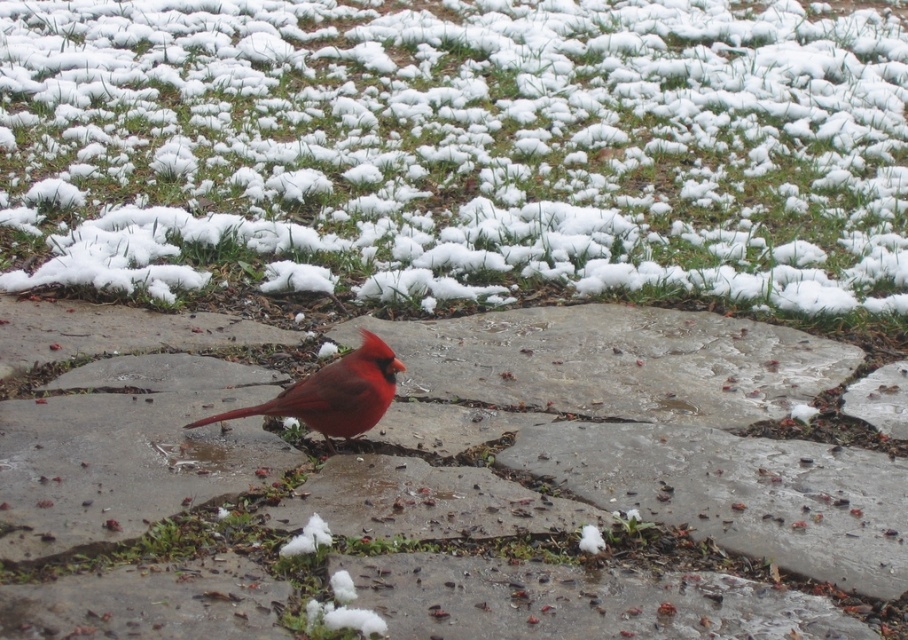
Question: Which object appears farthest from the camera in this image?

Choices:
 (A) smooth concrete at center
 (B) white fluffy grass at upper center

Answer: (B)

Question: Which of these objects is positioned farthest from the smooth concrete at center?

Choices:
 (A) white fluffy grass at upper center
 (B) matte red bird at center

Answer: (A)

Question: Is white fluffy grass at upper center wider than smooth concrete at center?

Choices:
 (A) no
 (B) yes

Answer: (A)

Question: Which point is farther from the camera taking this photo?

Choices:
 (A) (834, 248)
 (B) (347, 353)
 (C) (732, 577)

Answer: (A)

Question: Considering the relative positions of smooth concrete at center and matte red bird at center in the image provided, where is smooth concrete at center located with respect to matte red bird at center?

Choices:
 (A) left
 (B) right

Answer: (B)

Question: Can you confirm if smooth concrete at center is positioned to the right of matte red bird at center?

Choices:
 (A) no
 (B) yes

Answer: (B)